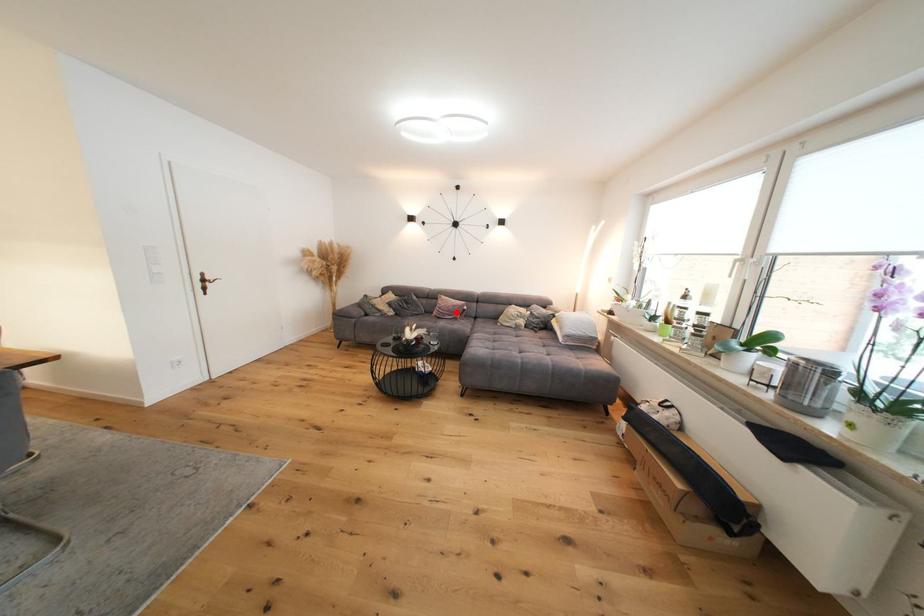
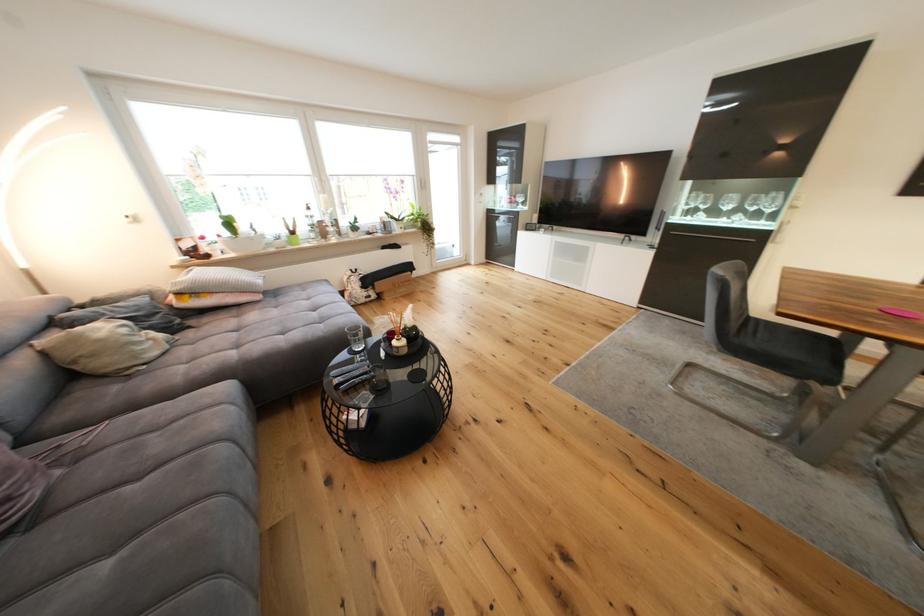
Question: I am providing you with two images of the same scene from different viewpoints. Image1 has a red point marked. In image2, the corresponding 3D location appears at what relative position? Reply with the corresponding letter.

Choices:
 (A) Closer
 (B) Farther

Answer: (B)